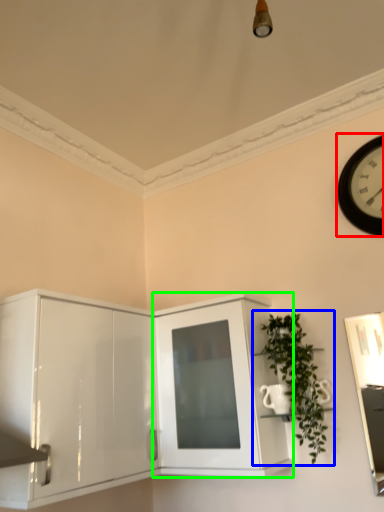
Question: Estimate the real-world distances between objects in this image. Which object is farther from wall clock (highlighted by a red box), houseplant (highlighted by a blue box) or cabinetry (highlighted by a green box)?

Choices:
 (A) houseplant
 (B) cabinetry

Answer: (B)